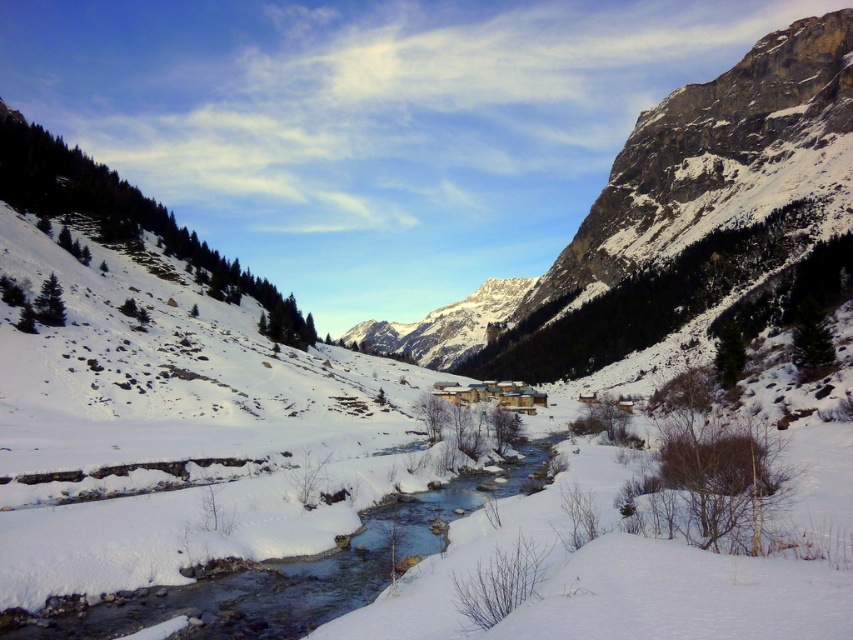
Question: Does clear ice water at center have a lesser width compared to snowy granite mountain at center?

Choices:
 (A) no
 (B) yes

Answer: (B)

Question: Is clear ice water at center further to the viewer compared to snowy granite mountain at center?

Choices:
 (A) no
 (B) yes

Answer: (A)

Question: Is clear ice water at center smaller than snowy granite mountain at center?

Choices:
 (A) yes
 (B) no

Answer: (A)

Question: Which of the following is the closest to the observer?

Choices:
 (A) (204, 621)
 (B) (403, 349)

Answer: (A)